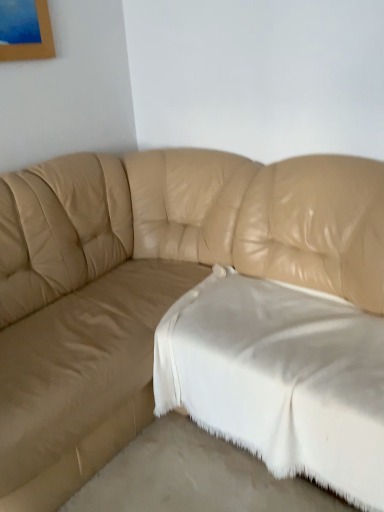
Question: In the image, is white soft fabric at lower right positioned in front of or behind tan leather couch at center?

Choices:
 (A) front
 (B) behind

Answer: (B)

Question: From the image's perspective, is white soft fabric at lower right positioned above or below tan leather couch at center?

Choices:
 (A) above
 (B) below

Answer: (B)

Question: Based on their relative distances, which object is nearer to the tan leather couch at center?

Choices:
 (A) white soft fabric at lower right
 (B) white fabric at lower center

Answer: (A)

Question: Which of these objects is positioned closest to the tan leather couch at center?

Choices:
 (A) white soft fabric at lower right
 (B) white fabric at lower center

Answer: (A)